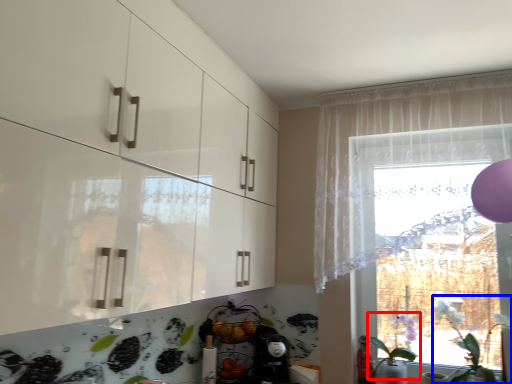
Question: Which point is closer to the camera, plant (highlighted by a red box) or plant (highlighted by a blue box)?

Choices:
 (A) plant
 (B) plant

Answer: (B)